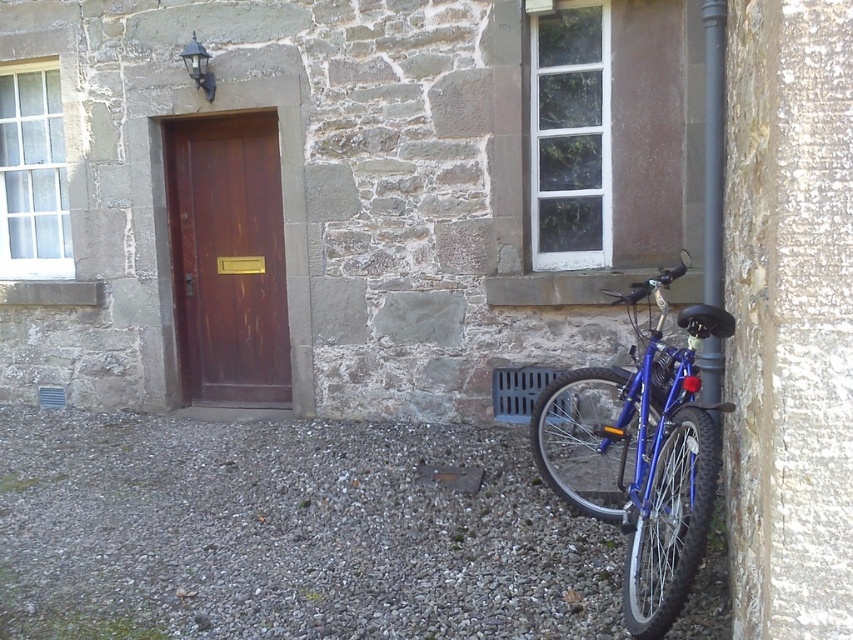
You are standing in front of the brown wooden door at center and want to hang a decorative wreath above it. The wreath requires a hook that must be placed at least 1.5 meters above the door. Given the height of the blue metallic bicycle at right, can you determine if the wreath hook can be placed without exceeding the door height?

The blue metallic bicycle at right has a lesser height compared to the brown wooden door at center. Since the bicycle is shorter than the door, the wreath hook can be placed at least 1.5 meters above the door without exceeding its height.

You are standing in front of the stone building and want to park your bicycle. The blue metallic bicycle at right is already parked. Can you park your bicycle next to the brown wooden door at center without blocking the door?

The blue metallic bicycle at right is positioned under the brown wooden door at center, so parking another bicycle next to the brown wooden door at center might block the door as there is limited space.